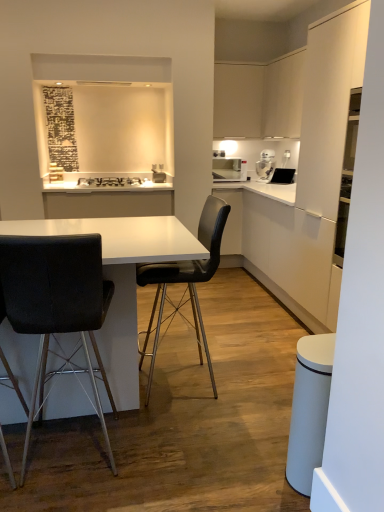
Question: Considering the positions of white glossy coffee machine at upper right and matte white microwave at upper right in the image, is white glossy coffee machine at upper right wider or thinner than matte white microwave at upper right?

Choices:
 (A) wide
 (B) thin

Answer: (B)

Question: From a real-world perspective, relative to matte white microwave at upper right, is white glossy coffee machine at upper right vertically above or below?

Choices:
 (A) above
 (B) below

Answer: (A)

Question: Which object is positioned farthest from the white matte cabinet at right?

Choices:
 (A) matte white microwave at upper right
 (B) white glossy table at center
 (C) black leather chair at center, the 2th chair positioned from the left
 (D) white glossy coffee machine at upper right
 (E) black leather chair at left, acting as the 2th chair starting from the right

Answer: (E)

Question: Based on their relative distances, which object is nearer to the white glossy table at center?

Choices:
 (A) matte white microwave at upper right
 (B) black leather chair at left, the 1th chair when ordered from left to right
 (C) black matte stove at upper center
 (D) white matte cabinet at right
 (E) white glossy coffee machine at upper right

Answer: (B)